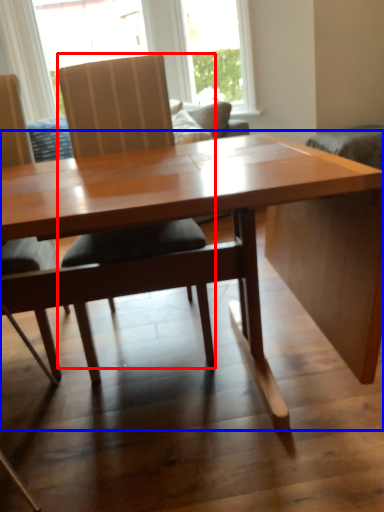
Question: Which of the following is the closest to the observer, chair (highlighted by a red box) or table (highlighted by a blue box)?

Choices:
 (A) chair
 (B) table

Answer: (B)